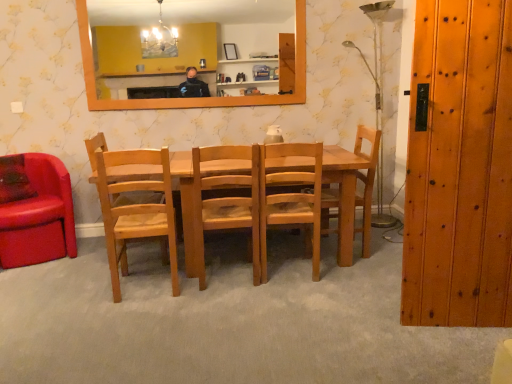
Image resolution: width=512 pixels, height=384 pixels. Find the location of `free space to the right of natural wood chair at left, the 2th chair from the left`. free space to the right of natural wood chair at left, the 2th chair from the left is located at coordinates (204, 295).